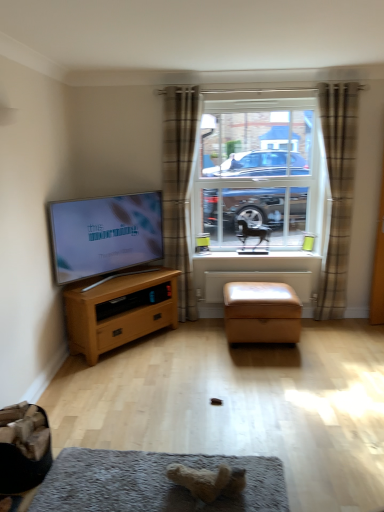
Question: Would you say soft gray carpet at lower center is a long distance from brown plaid curtain at right, which is the 2th curtain from left to right?

Choices:
 (A) no
 (B) yes

Answer: (B)

Question: Does soft gray carpet at lower center touch brown plaid curtain at right, the first curtain when ordered from right to left?

Choices:
 (A) yes
 (B) no

Answer: (B)

Question: From a real-world perspective, does soft gray carpet at lower center sit lower than brown plaid curtain at right, which is the 2th curtain from left to right?

Choices:
 (A) yes
 (B) no

Answer: (A)

Question: Can you confirm if soft gray carpet at lower center is smaller than brown plaid curtain at right, the first curtain when ordered from right to left?

Choices:
 (A) no
 (B) yes

Answer: (B)

Question: Is soft gray carpet at lower center oriented towards brown plaid curtain at right, which is the 2th curtain from left to right?

Choices:
 (A) no
 (B) yes

Answer: (A)

Question: Considering the relative sizes of soft gray carpet at lower center and brown plaid curtain at right, the first curtain when ordered from right to left, in the image provided, is soft gray carpet at lower center taller than brown plaid curtain at right, the first curtain when ordered from right to left,?

Choices:
 (A) no
 (B) yes

Answer: (A)

Question: From a real-world perspective, does fuzzy beige teddy bear at lower center, the first animal ordered from the bottom, sit lower than satin tan ottoman at center?

Choices:
 (A) yes
 (B) no

Answer: (A)

Question: From the image's perspective, is fuzzy beige teddy bear at lower center, acting as the 2th animal starting from the back, below satin tan ottoman at center?

Choices:
 (A) yes
 (B) no

Answer: (A)

Question: Can satin tan ottoman at center be found inside fuzzy beige teddy bear at lower center, positioned as the 2th animal in top-to-bottom order?

Choices:
 (A) no
 (B) yes

Answer: (A)

Question: Is fuzzy beige teddy bear at lower center, the first animal ordered from the bottom, not near satin tan ottoman at center?

Choices:
 (A) yes
 (B) no

Answer: (A)

Question: Considering the relative sizes of fuzzy beige teddy bear at lower center, the 1th animal when ordered from left to right, and satin tan ottoman at center in the image provided, is fuzzy beige teddy bear at lower center, the 1th animal when ordered from left to right, shorter than satin tan ottoman at center?

Choices:
 (A) no
 (B) yes

Answer: (B)

Question: Does fuzzy beige teddy bear at lower center, the first animal ordered from the bottom, appear on the right side of satin tan ottoman at center?

Choices:
 (A) no
 (B) yes

Answer: (A)

Question: Is plaid fabric curtain at center, the 2th curtain when ordered from right to left, to the right of wooden chest of drawers at left from the viewer's perspective?

Choices:
 (A) no
 (B) yes

Answer: (B)